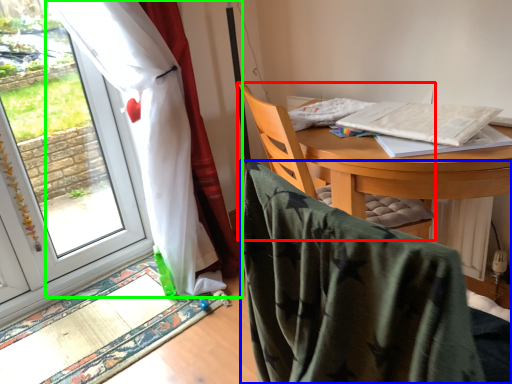
Question: Based on their relative distances, which object is farther from chair (highlighted by a red box)? Choose from chair (highlighted by a blue box) and curtain (highlighted by a green box).

Choices:
 (A) chair
 (B) curtain

Answer: (B)